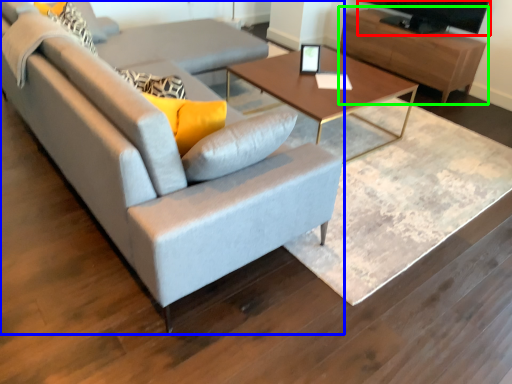
Question: Estimate the real-world distances between objects in this image. Which object is closer to television (highlighted by a red box), studio couch (highlighted by a blue box) or entertainment center (highlighted by a green box)?

Choices:
 (A) studio couch
 (B) entertainment center

Answer: (B)